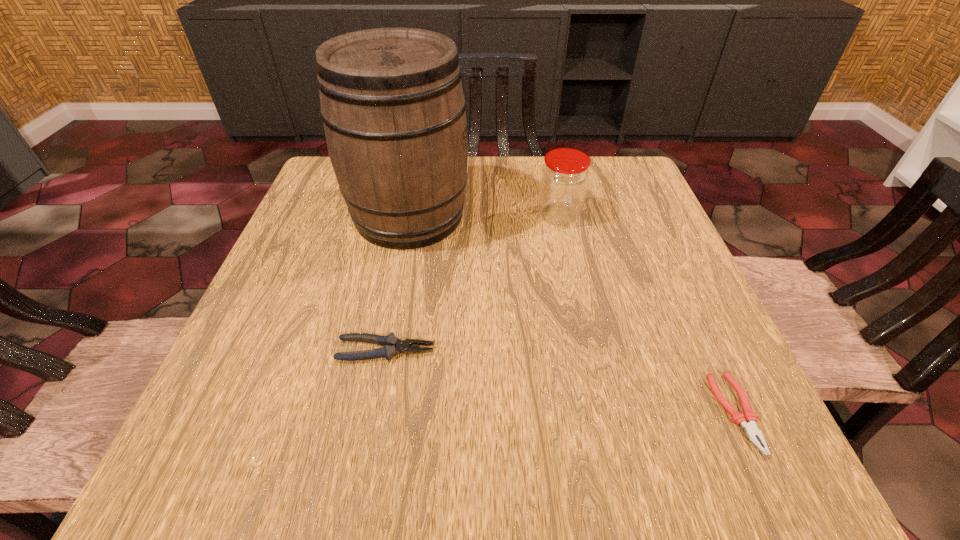
You are a GUI agent. You are given a task and a screenshot of the screen. Output one action in this format:
    pyautogui.click(x=<x>, y=<y>)
    Task: Click on the unoccupied position between the nearest object and the third tallest object
    The width and height of the screenshot is (960, 540).
    Given the screenshot: What is the action you would take?
    pyautogui.click(x=561, y=381)

At what (x,y) coordinates should I click in order to perform the action: click on empty space that is in between the rightmost object and the third shortest object. Please return your answer as a coordinate pair (x, y). This screenshot has width=960, height=540. Looking at the image, I should click on (647, 314).

Where is `free space between the rightmost object and the jar`? The width and height of the screenshot is (960, 540). free space between the rightmost object and the jar is located at coordinates (647, 314).

Locate an element on the screen. Image resolution: width=960 pixels, height=540 pixels. free space between the wine bucket and the third object from left to right is located at coordinates (484, 216).

Point out which object is positioned as the third nearest to the tallest object. Please provide its 2D coordinates. Your answer should be formatted as a tuple, i.e. [(x, y)], where the tuple contains the x and y coordinates of a point satisfying the conditions above.

[(747, 420)]

At what (x,y) coordinates should I click in order to perform the action: click on object that is the third closest one to the third farthest object. Please return your answer as a coordinate pair (x, y). The image size is (960, 540). Looking at the image, I should click on (747, 420).

This screenshot has width=960, height=540. In order to click on free spot that satisfies the following two spatial constraints: 1. on the back side of the rightmost object; 2. at the gripping part of the left pliers in this screenshot , I will do `click(708, 350)`.

Locate an element on the screen. The image size is (960, 540). vacant space that satisfies the following two spatial constraints: 1. at the gripping part of the rightmost object; 2. on the left side of the farther pliers is located at coordinates (374, 413).

This screenshot has width=960, height=540. In order to click on vacant region that satisfies the following two spatial constraints: 1. on the front side of the second object from right to left; 2. on the right side of the nearest object in this screenshot , I will do `click(602, 413)`.